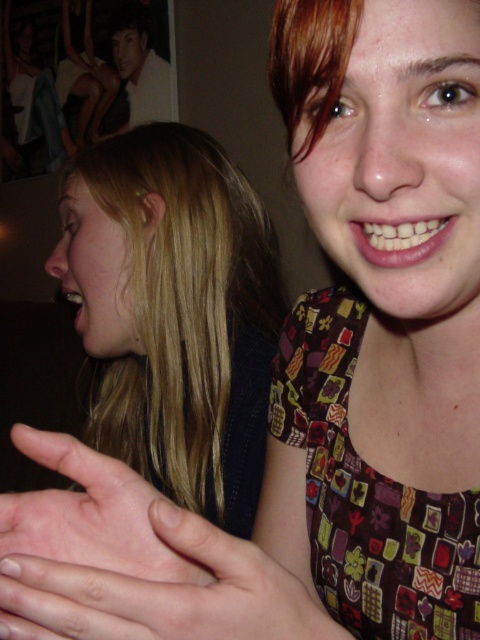
Question: Among these points, which one is nearest to the camera?

Choices:
 (A) (126, 13)
 (B) (276, 340)
 (C) (91, 548)

Answer: (C)

Question: Can you confirm if blondehair at left is positioned to the right of pink flesh at center?

Choices:
 (A) no
 (B) yes

Answer: (A)

Question: Is pink flesh at center below smooth white shirt at upper left?

Choices:
 (A) yes
 (B) no

Answer: (A)

Question: Is blondehair at left below pink matte skin at center?

Choices:
 (A) yes
 (B) no

Answer: (B)

Question: Which is farther from the blondehair at left?

Choices:
 (A) pink matte skin at center
 (B) smooth white shirt at upper left

Answer: (B)

Question: Estimate the real-world distances between objects in this image. Which object is farther from the blondehair at left?

Choices:
 (A) pink matte skin at center
 (B) smooth white shirt at upper left

Answer: (B)